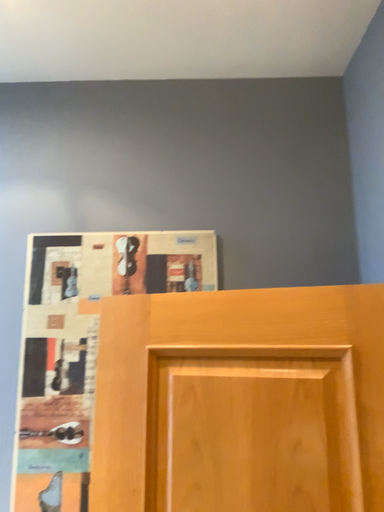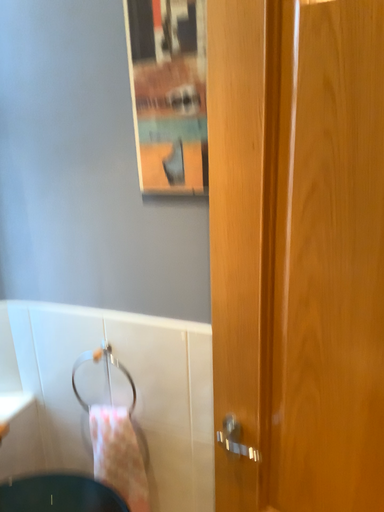
Question: Which way did the camera rotate in the video?

Choices:
 (A) rotated right
 (B) rotated left

Answer: (B)